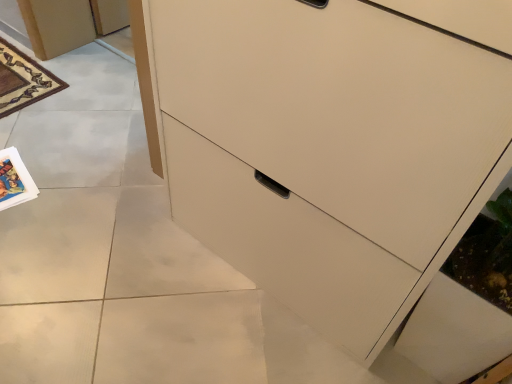
Question: Should I look upward or downward to see matte paper magazine at lower left?

Choices:
 (A) up
 (B) down

Answer: (A)